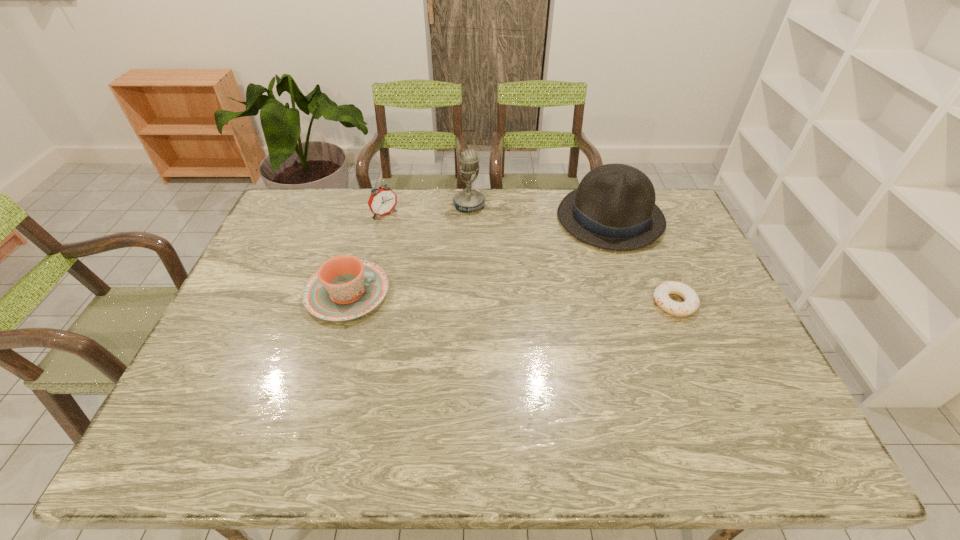
At what (x,y) coordinates should I click in order to perform the action: click on free space on the desktop that is between the fourth tallest object and the shortest object and is positioned on the clock face of the third tallest object. Please return your answer as a coordinate pair (x, y). The height and width of the screenshot is (540, 960). Looking at the image, I should click on (465, 296).

Locate an element on the screen. Image resolution: width=960 pixels, height=540 pixels. vacant space on the desktop that is between the chinaware and the shortest object and is positioned on the front-facing side of the bowler hat is located at coordinates (503, 298).

The width and height of the screenshot is (960, 540). Identify the location of free space on the desktop that is between the chinaware and the doughnut and is positioned on the front-facing side of the tallest object. (524, 299).